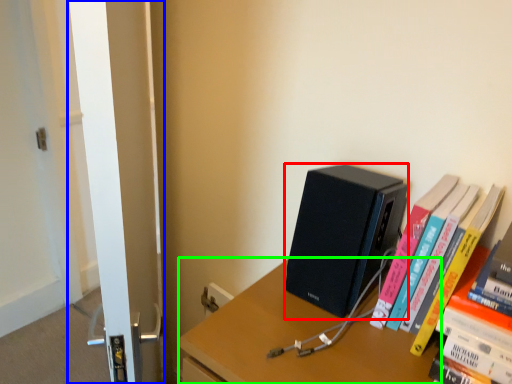
Question: Which object is positioned farthest from computer (highlighted by a red box)? Select from screen door (highlighted by a blue box) and desk (highlighted by a green box).

Choices:
 (A) screen door
 (B) desk

Answer: (A)